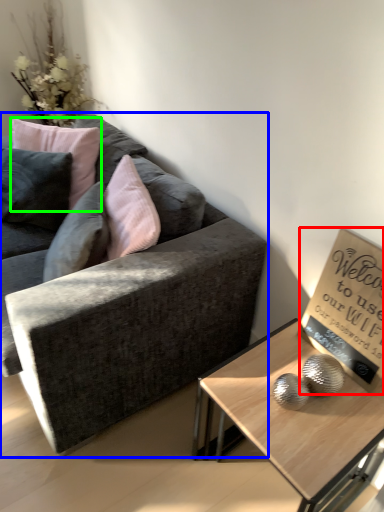
Question: Estimate the real-world distances between objects in this image. Which object is farther from bulletin board (highlighted by a red box), studio couch (highlighted by a blue box) or pillow (highlighted by a green box)?

Choices:
 (A) studio couch
 (B) pillow

Answer: (B)